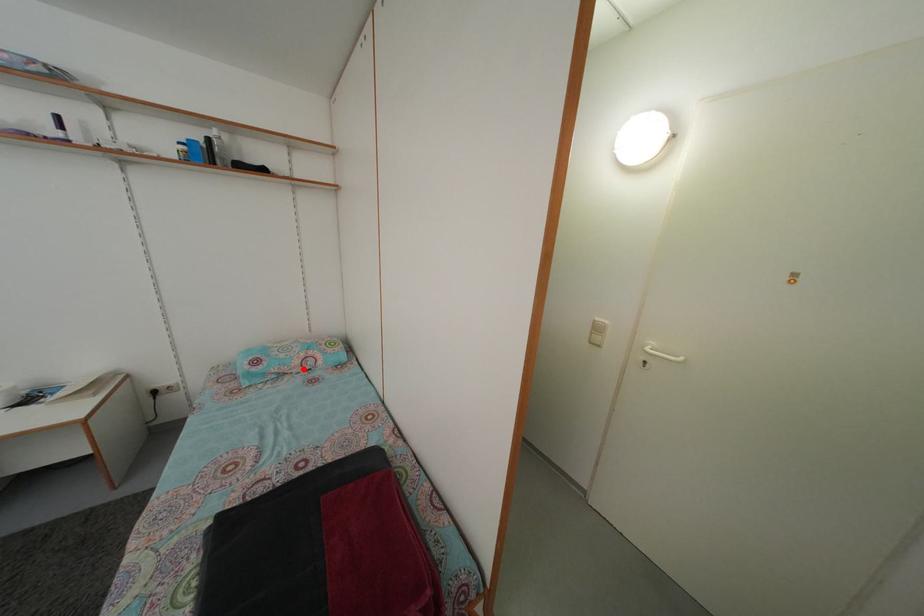
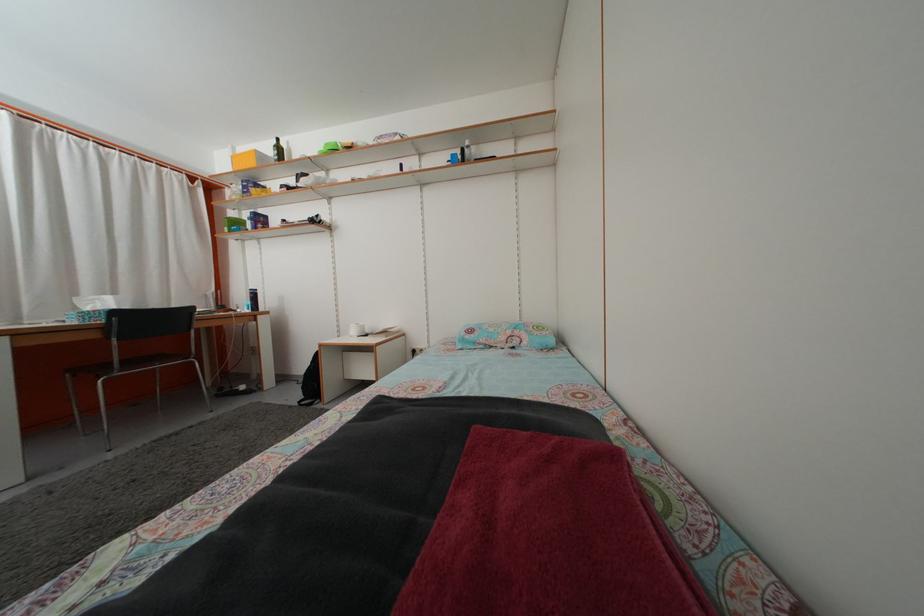
The point at the highlighted location is marked in the first image. Where is the corresponding point in the second image?

(508, 346)